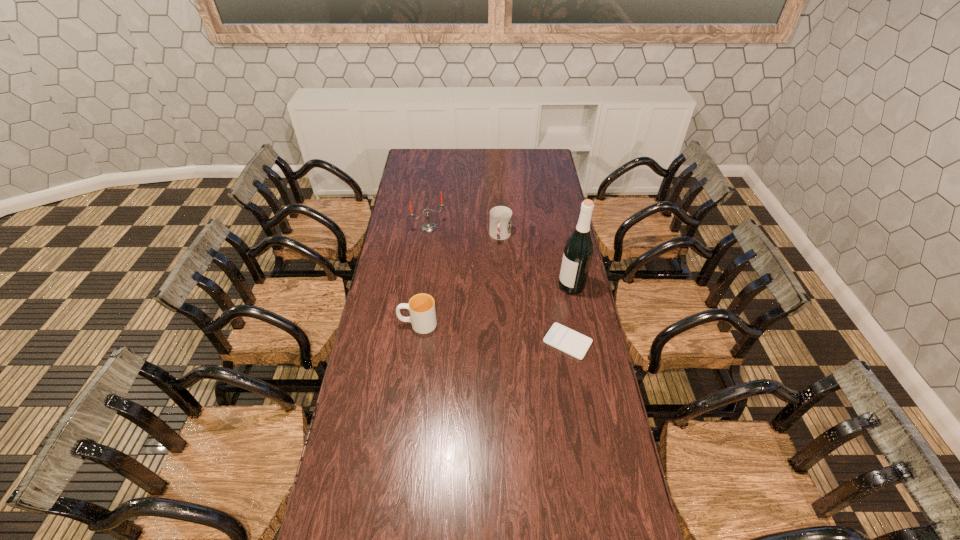
Locate an element on the screen. free space located 0.330m on the front-facing side of the candle is located at coordinates coord(468,274).

Where is `vacant space located on the front-facing side of the candle`? vacant space located on the front-facing side of the candle is located at coordinates (469, 275).

This screenshot has height=540, width=960. In order to click on vacant space located 0.210m on the label of the tallest object in this screenshot , I will do `click(519, 309)`.

Find the location of `vacant area located on the label of the tallest object`. vacant area located on the label of the tallest object is located at coordinates (547, 297).

You are a GUI agent. You are given a task and a screenshot of the screen. Output one action in this format:
    pyautogui.click(x=<x>, y=<y>)
    Task: Click on the vacant region located on the label of the tallest object
    
    Given the screenshot: What is the action you would take?
    pyautogui.click(x=540, y=300)

Identify the location of vacant area situated on the side of the right cup where the handle is located. The width and height of the screenshot is (960, 540). (491, 290).

At what (x,y) coordinates should I click in order to perform the action: click on free space located 0.100m on the side of the right cup where the handle is located. Please return your answer as a coordinate pair (x, y). Looking at the image, I should click on (496, 260).

Identify the location of free location located on the side of the right cup where the handle is located. This screenshot has height=540, width=960. (493, 277).

Where is `cup located in the left edge section of the desktop`? The image size is (960, 540). cup located in the left edge section of the desktop is located at coordinates (421, 306).

This screenshot has width=960, height=540. In order to click on candle present at the left edge in this screenshot , I will do `click(429, 226)`.